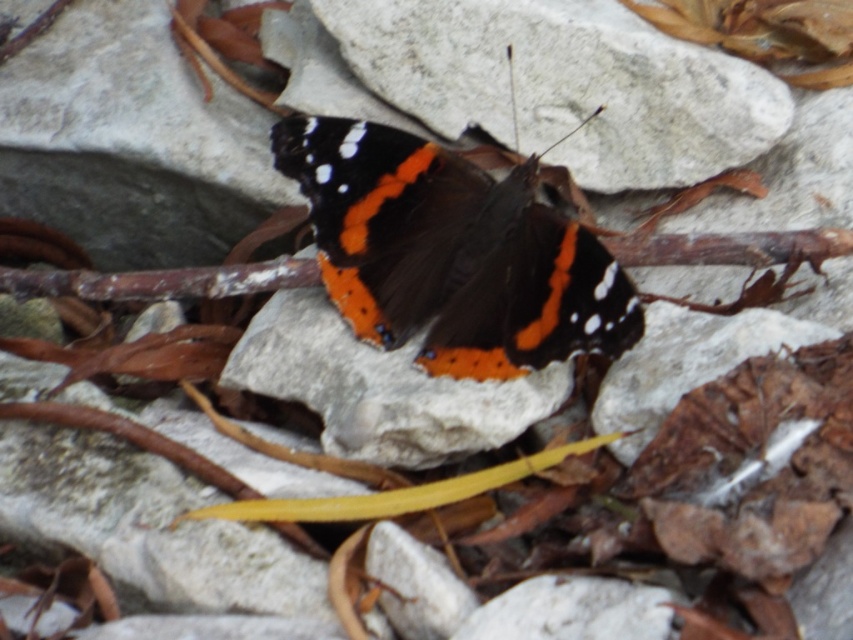
You are an entomologist observing the scene. You need to determine if the matte black and orange butterfly at center is resting on the white rough stone at center. Based on their positions, can you confirm this?

The matte black and orange butterfly at center is in front of the white rough stone at center, so it is resting on the stone.

You are a nature photographer trying to capture the matte black and orange butterfly at center and the white rough stone at center in your shot. Based on their positions, which object is closer to the left side of the frame?

The matte black and orange butterfly at center is to the left of the white rough stone at center, so it is closer to the left side of the frame.